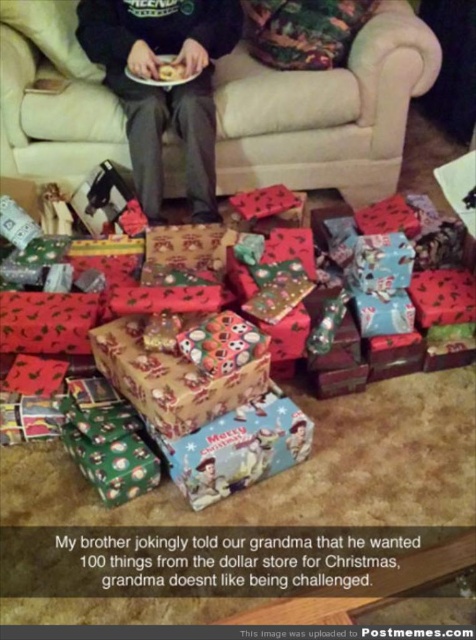
You are a delivery person standing at the entrance of the living room. You need to place a new package that measures 10 inches in length between the beige fabric couch at upper center and the black matte pants at center. Is there enough space to fit the package between them?

The distance between the beige fabric couch at upper center and the black matte pants at center is 9.31 inches. Since the package is 10 inches long, it won not fit between them as the space is slightly smaller than the package.

You are a delivery person who just arrived at the house. You need to place a large box that is 1.5 meters long on the floor. The box must be placed between the beige fabric couch at upper center and the viewer. Is there enough space?

The distance between the beige fabric couch at upper center and the viewer is 1.83 meters, which is greater than the length of the box, so yes, there is enough space to place the box between the beige fabric couch at upper center and the viewer.

You are standing at the origin point in the living room and need to reach the gift located at point (168, 106). There is another gift at point (0, 19). Which gift is closer to your current position?

The gift at point (168, 106) is closer to your current position because it is in front of the gift at point (0, 19), which is behind it.